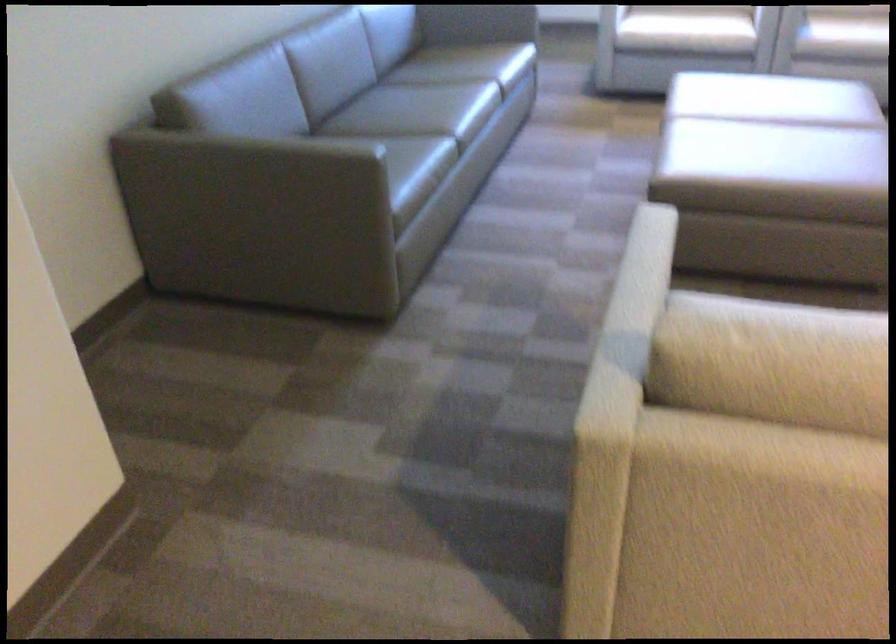
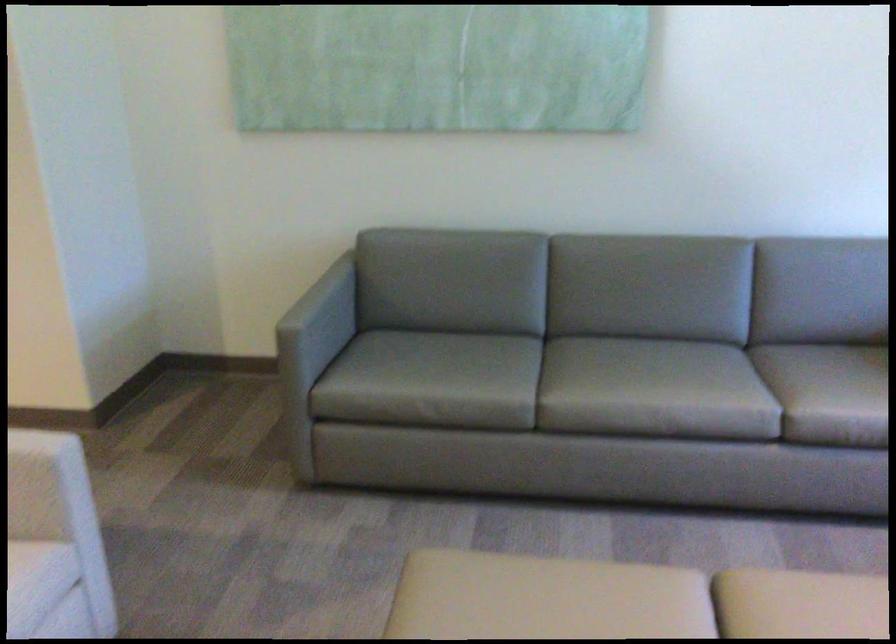
Find the pixel in the second image that matches point (432, 108) in the first image.

(613, 386)